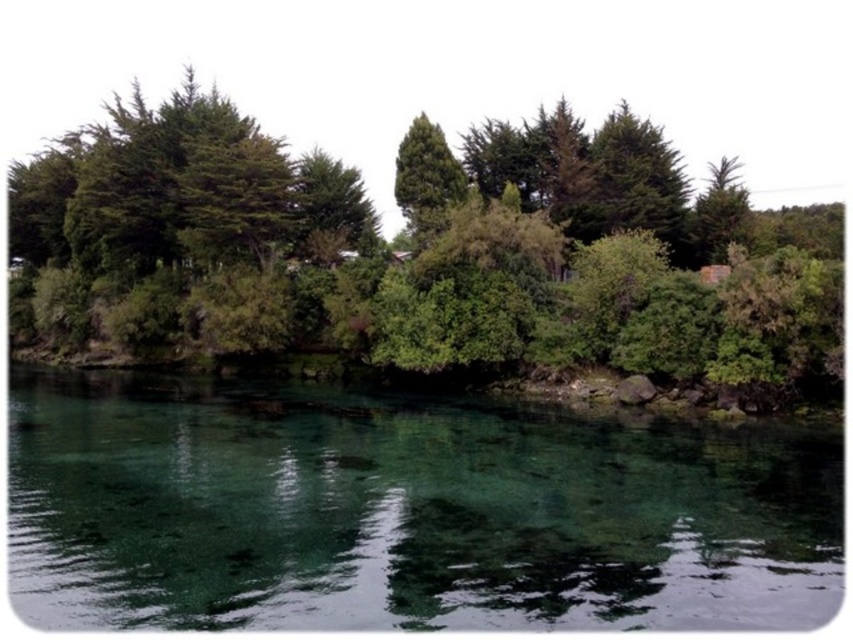
You are standing at the edge of the water and see the green leafy trees at center and the green leafy tree at center. Which one is positioned to the left?

The green leafy trees at center are positioned to the left of the green leafy tree at center.

You are standing at the edge of the water in the scene. Which object, the clear glass water at center or the green leafy trees at center, is nearer to you?

The clear glass water at center is closer to the viewer than the green leafy trees at center.

You are standing at the camera position looking at the serene natural landscape. There is a point marked at coordinates point (99, 563). Can you estimate how far this point is from your current position?

The point (99, 563) is 41.84 feet away from the camera, so the distance is approximately 41.84 feet.